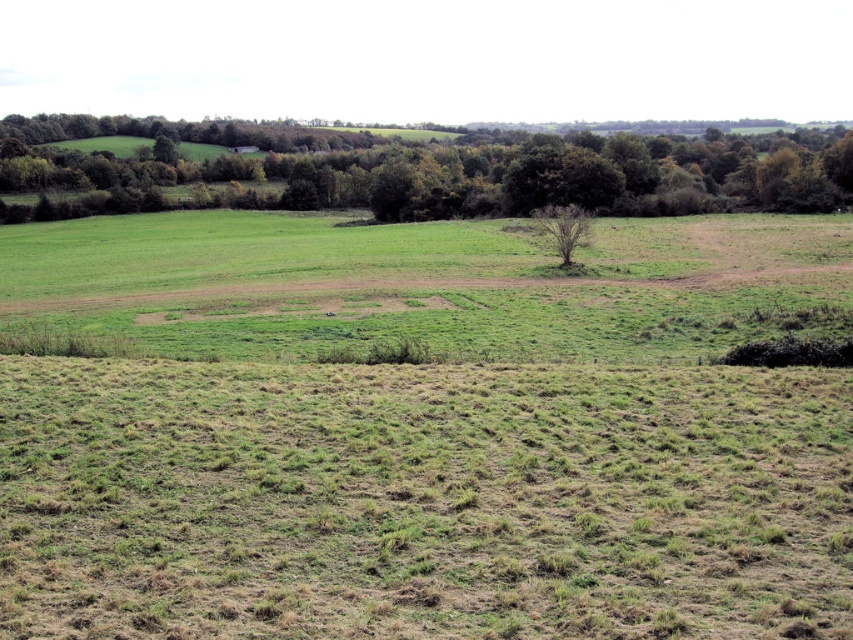
Does green leafy tree at upper center have a larger size compared to bare brown tree at center?

Yes, green leafy tree at upper center is bigger than bare brown tree at center.

Find the location of a particular element. The width and height of the screenshot is (853, 640). green leafy tree at upper center is located at coordinates (422, 170).